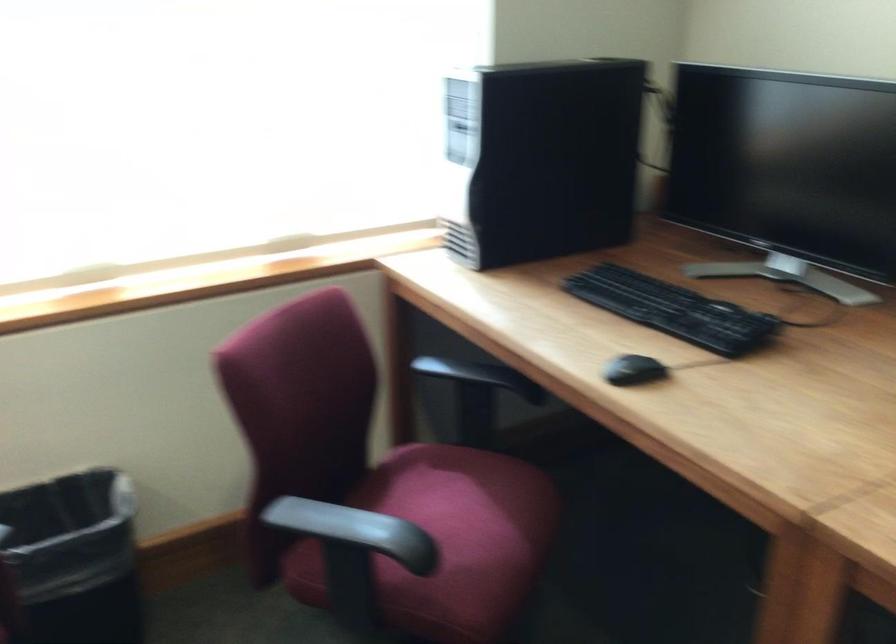
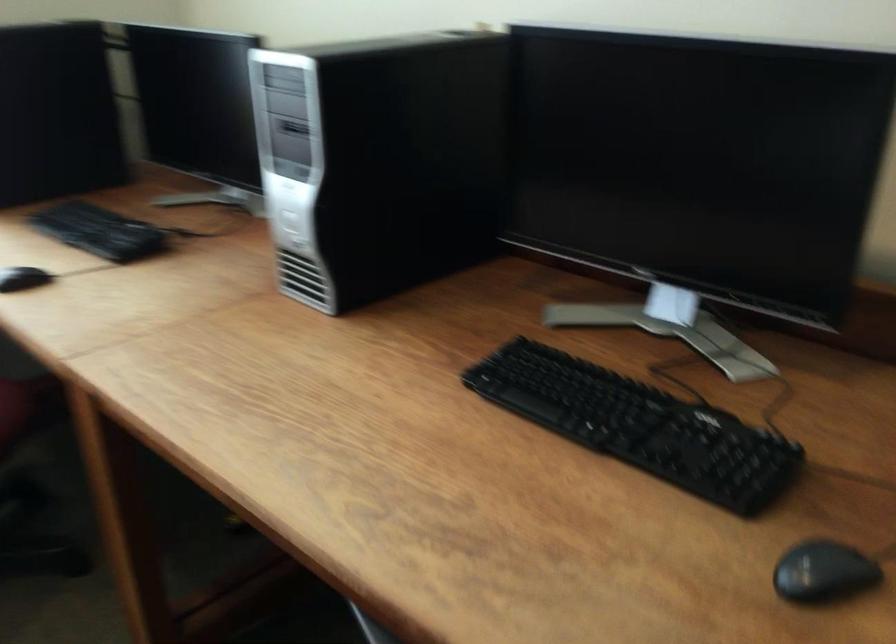
Question: The camera is either moving clockwise (left) or counter-clockwise (right) around the object. The first image is from the beginning of the video and the second image is from the end. Is the camera moving left or right when shooting the video?

Choices:
 (A) Left
 (B) Right

Answer: (A)